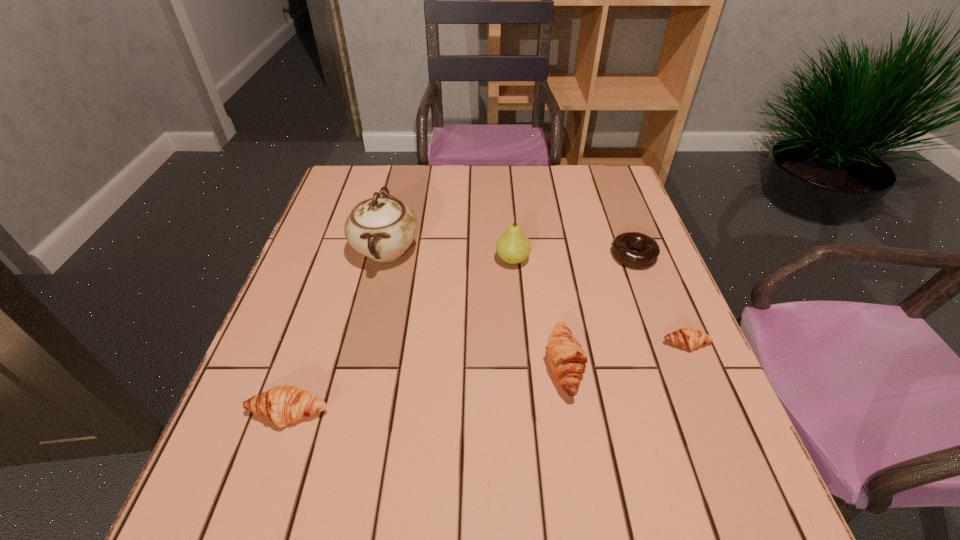
What are the coordinates of `unoccupied position between the leftmost pastry and the fifth shortest object` in the screenshot? It's located at (401, 336).

Locate an element on the screen. The height and width of the screenshot is (540, 960). free space that is in between the fifth shortest object and the rightmost pastry is located at coordinates 599,302.

Identify the location of the second closest object to the fifth shortest object. Image resolution: width=960 pixels, height=540 pixels. (382, 228).

Select which object appears as the closest to the doughnut. Please provide its 2D coordinates. Your answer should be formatted as a tuple, i.e. [(x, y)], where the tuple contains the x and y coordinates of a point satisfying the conditions above.

[(687, 338)]

Identify which pastry is located as the nearest to the pear. Please provide its 2D coordinates. Your answer should be formatted as a tuple, i.e. [(x, y)], where the tuple contains the x and y coordinates of a point satisfying the conditions above.

[(567, 359)]

Identify the location of the third closest pastry to the doughnut. (282, 405).

This screenshot has height=540, width=960. Identify the location of vacant area that satisfies the following two spatial constraints: 1. on the front-facing side of the rightmost pastry; 2. on the front-facing side of the second pastry from left to right. (695, 365).